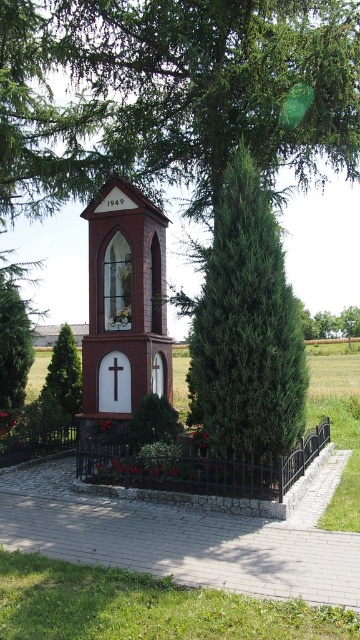
You are a photographer planning to capture a symmetrical composition of the white matte cross at center and the green leafy tree at lower left. Considering their widths, which object would require more space to frame properly in your shot?

The green leafy tree at lower left requires more space to frame properly because its width surpasses that of the white matte cross at center.

You are standing in front of the small red brick structure and want to take a photo of it. The green leafy tree at lower left is blocking part of the structure. Can you move to the right to get a clear view of the structure without the tree obstructing it?

The green leafy tree at lower left is located at point [65,372], so moving to the right might allow you to position yourself where the tree no longer blocks the view of the structure.

You are a painter planning to paint the black wrought iron fence at center and the green leafy tree at lower left. Which object requires more time to paint due to its size?

The black wrought iron fence at center requires more time to paint because it has a larger size compared to the green leafy tree at lower left.